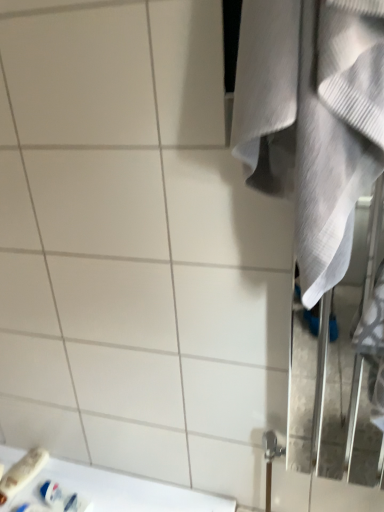
Question: Is point (56, 507) closer or farther from the camera than point (28, 467)?

Choices:
 (A) closer
 (B) farther

Answer: (A)

Question: From a real-world perspective, is white plastic toothpaste tube at lower left, which is the 2th toiletry in left-to-right order, above or below white plastic toothbrush at lower left, the second toiletry positioned from the right?

Choices:
 (A) below
 (B) above

Answer: (B)

Question: Which object is the farthest from the white glossy counter top at lower left?

Choices:
 (A) white textured towel at right
 (B) white plastic toothbrush at lower left, which ranks as the first toiletry in left-to-right order
 (C) white plastic toothpaste tube at lower left, which is the first toiletry in right-to-left order

Answer: (A)

Question: Estimate the real-world distances between objects in this image. Which object is farther from the white glossy counter top at lower left?

Choices:
 (A) white textured towel at right
 (B) white plastic toothpaste tube at lower left, which is the first toiletry in right-to-left order
 (C) white plastic toothbrush at lower left, the second toiletry positioned from the right

Answer: (A)